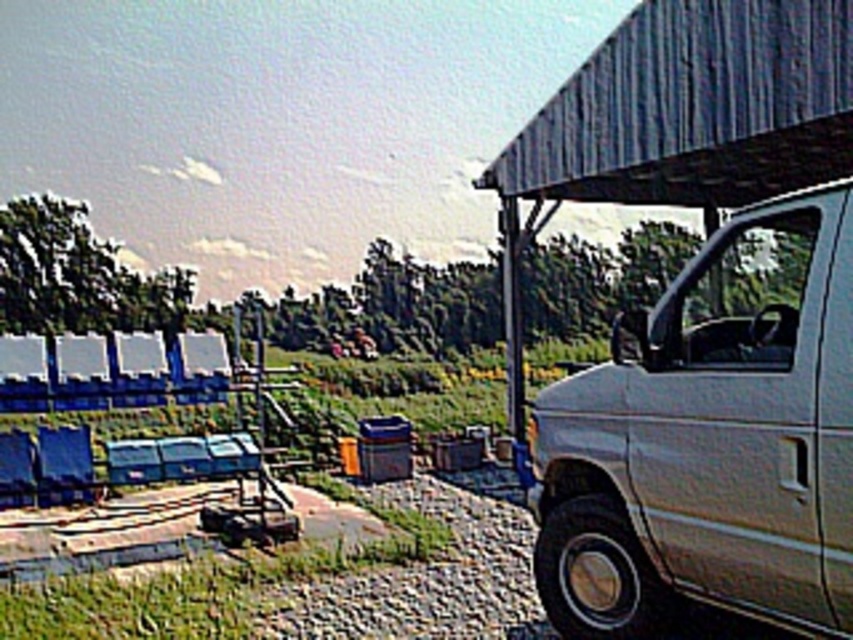
You are a delivery driver who needs to park your truck next to the white matte van at right and the metallic gray awning at upper right. Based on their sizes, which one should you park closer to?

You should park closer to the white matte van at right because it occupies less space than the metallic gray awning at upper right, making it easier to maneuver around.

You are a delivery driver who needs to park your van under the metallic gray awning at upper right. Based on the scene, can your white matte van at right fit under it considering their sizes?

The white matte van at right is shorter than the metallic gray awning at upper right, so it should fit under the awning as the van is shorter than the awning.